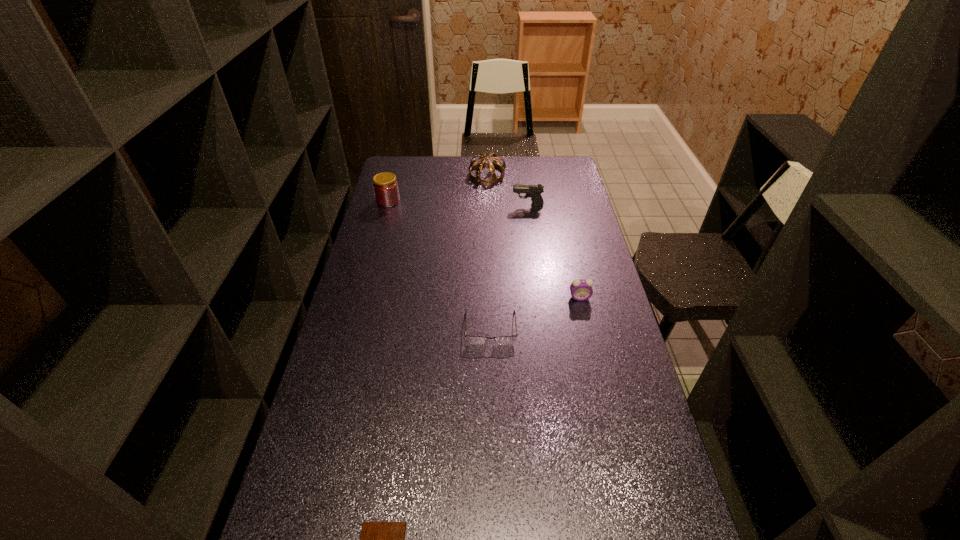
This screenshot has height=540, width=960. I want to click on free space located at the barrel of the pistol, so click(x=434, y=205).

Locate an element on the screen. free location located 0.270m at the barrel of the pistol is located at coordinates (450, 205).

Identify the location of vacant position located 0.090m at the barrel of the pistol. This screenshot has height=540, width=960. (492, 205).

The height and width of the screenshot is (540, 960). I want to click on free region located on the face of the taller alarm clock, so click(x=596, y=368).

Find the location of a particular element. Image resolution: width=960 pixels, height=540 pixels. free space located on the front-facing side of the spectacles is located at coordinates (492, 424).

Where is `object present at the far edge`? The image size is (960, 540). object present at the far edge is located at coordinates (492, 178).

Where is `object positioned at the left edge`? object positioned at the left edge is located at coordinates pos(385,186).

Where is `object at the right edge`? The image size is (960, 540). object at the right edge is located at coordinates click(x=581, y=289).

Locate an element on the screen. The image size is (960, 540). free space at the far edge is located at coordinates (485, 168).

Locate an element on the screen. Image resolution: width=960 pixels, height=540 pixels. blank space at the left edge is located at coordinates (396, 230).